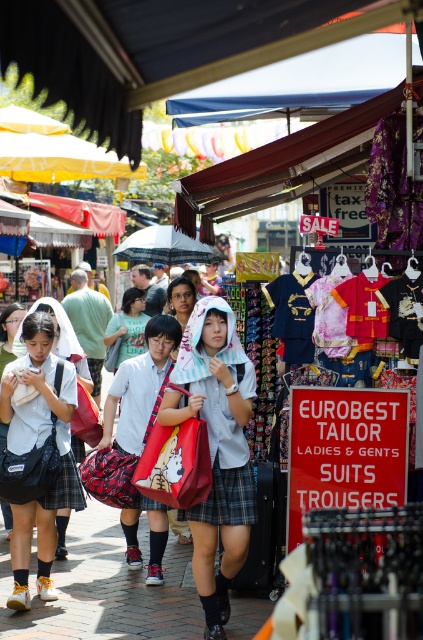
Question: Which point is farther from the camera taking this photo?

Choices:
 (A) click(x=211, y=496)
 (B) click(x=227, y=483)
 (C) click(x=21, y=605)
 (D) click(x=173, y=230)

Answer: (D)

Question: Is matte black school uniform at left above plaid fabric kilt at center?

Choices:
 (A) yes
 (B) no

Answer: (A)

Question: Is matte black school uniform at left above white fabric umbrella at center?

Choices:
 (A) no
 (B) yes

Answer: (A)

Question: Is matte black school uniform at left positioned before white fabric umbrella at center?

Choices:
 (A) yes
 (B) no

Answer: (A)

Question: Which point is farther to the camera?

Choices:
 (A) plaid fabric skirt at center
 (B) white fabric umbrella at center

Answer: (B)

Question: Based on their relative distances, which object is nearer to the white fabric umbrella at center?

Choices:
 (A) plaid fabric kilt at center
 (B) plaid fabric skirt at center

Answer: (B)